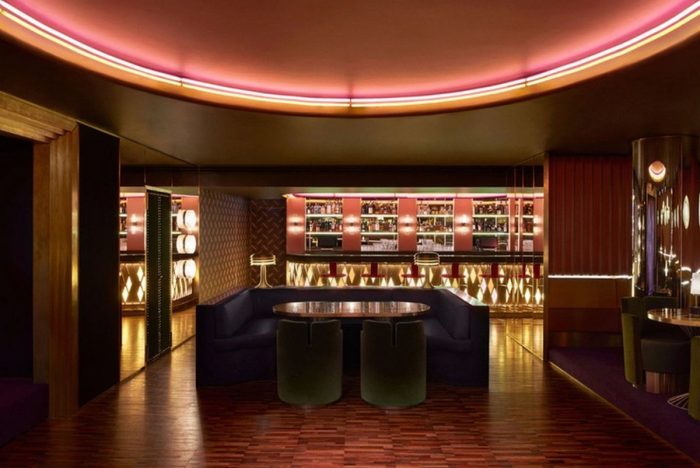
Where is `the left table cylinder stand`? The height and width of the screenshot is (468, 700). the left table cylinder stand is located at coordinates (323, 380).